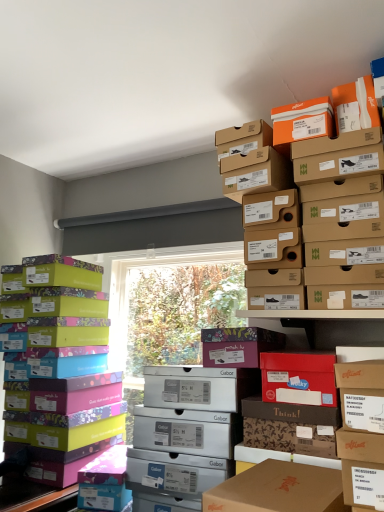
Question: Is multicolored cardboard shoebox at left placed right next to matte purple shoebox at center?

Choices:
 (A) yes
 (B) no

Answer: (B)

Question: Considering the relative sizes of multicolored cardboard shoebox at left and matte purple shoebox at center in the image provided, is multicolored cardboard shoebox at left taller than matte purple shoebox at center?

Choices:
 (A) yes
 (B) no

Answer: (A)

Question: Is multicolored cardboard shoebox at left far from matte purple shoebox at center?

Choices:
 (A) yes
 (B) no

Answer: (B)

Question: Is multicolored cardboard shoebox at left wider than matte purple shoebox at center?

Choices:
 (A) no
 (B) yes

Answer: (B)

Question: Is multicolored cardboard shoebox at left to the right of matte purple shoebox at center from the viewer's perspective?

Choices:
 (A) yes
 (B) no

Answer: (B)

Question: Does point (286, 172) appear closer or farther from the camera than point (251, 361)?

Choices:
 (A) farther
 (B) closer

Answer: (A)

Question: From a real-world perspective, relative to matte purple shoebox at center, is cardboard shoebox at upper center vertically above or below?

Choices:
 (A) above
 (B) below

Answer: (A)

Question: Looking at their shapes, would you say cardboard shoebox at upper center is wider or thinner than matte purple shoebox at center?

Choices:
 (A) wide
 (B) thin

Answer: (A)

Question: Is cardboard shoebox at upper center to the left or to the right of matte purple shoebox at center in the image?

Choices:
 (A) right
 (B) left

Answer: (A)

Question: Visually, is matte purple shoebox at center positioned to the left or to the right of multicolored cardboard shoebox at left?

Choices:
 (A) right
 (B) left

Answer: (A)

Question: Considering their positions, is matte purple shoebox at center located in front of or behind multicolored cardboard shoebox at left?

Choices:
 (A) behind
 (B) front

Answer: (B)

Question: In terms of height, does matte purple shoebox at center look taller or shorter compared to multicolored cardboard shoebox at left?

Choices:
 (A) short
 (B) tall

Answer: (A)

Question: In terms of size, does matte purple shoebox at center appear bigger or smaller than multicolored cardboard shoebox at left?

Choices:
 (A) big
 (B) small

Answer: (B)

Question: Relative to multicolored cardboard shoebox at left, is cardboard shoebox at upper center in front or behind?

Choices:
 (A) behind
 (B) front

Answer: (B)

Question: Considering the positions of cardboard shoebox at upper center and multicolored cardboard shoebox at left in the image, is cardboard shoebox at upper center wider or thinner than multicolored cardboard shoebox at left?

Choices:
 (A) wide
 (B) thin

Answer: (B)